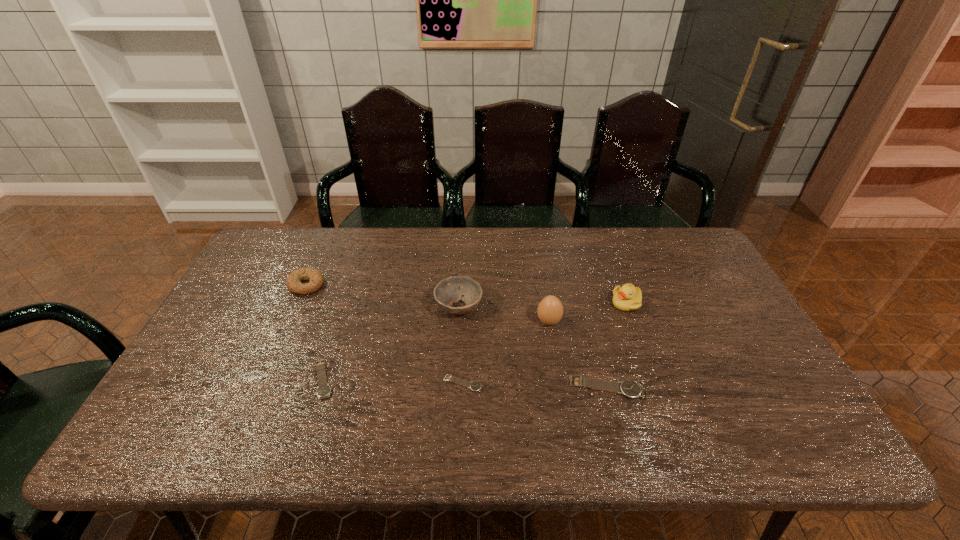
With all watchs evenly spaced, where should an extra watch be placed on the right to continue the pattern? Please point out a vacant space. Please provide its 2D coordinates. Your answer should be formatted as a tuple, i.e. [(x, y)], where the tuple contains the x and y coordinates of a point satisfying the conditions above.

[(752, 392)]